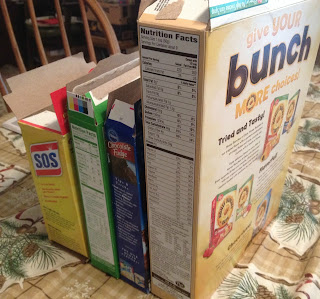
In order to click on boxes in this screenshot , I will do `click(178, 168)`, `click(118, 179)`, `click(87, 186)`, `click(50, 193)`.